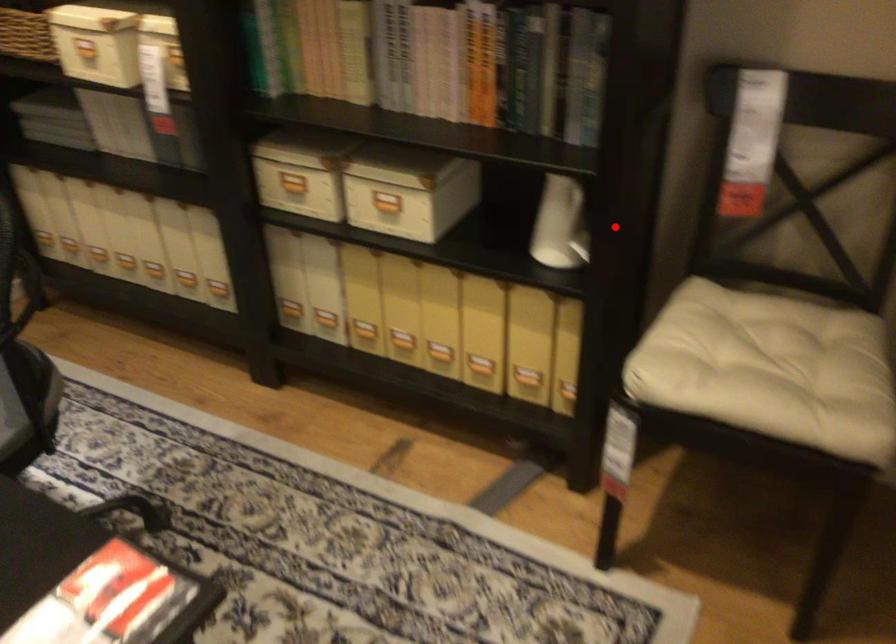
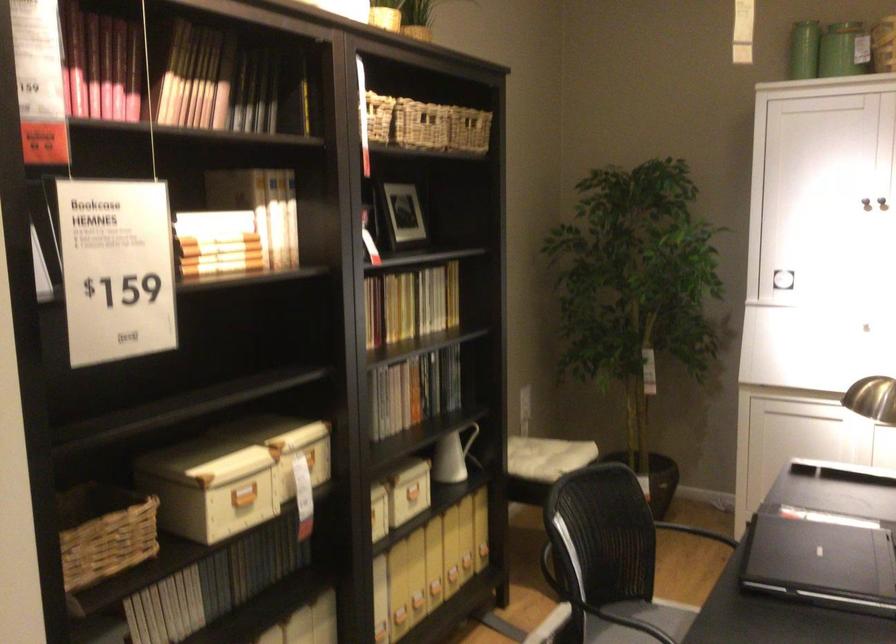
Find the pixel in the second image that matches the highlighted location in the first image.

(474, 444)